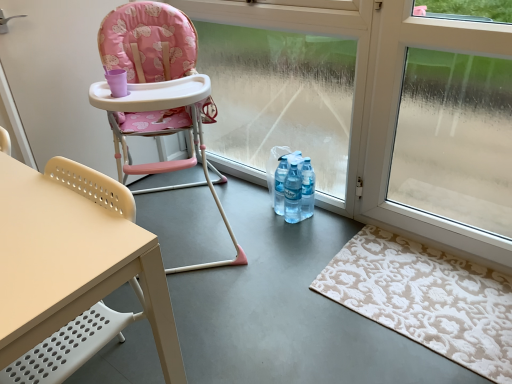
Locate an element on the screen. vacant area that lies between pink fabric highchair at left, the 1th chair when ordered from back to front, and transparent glass window at lower right is located at coordinates (315, 248).